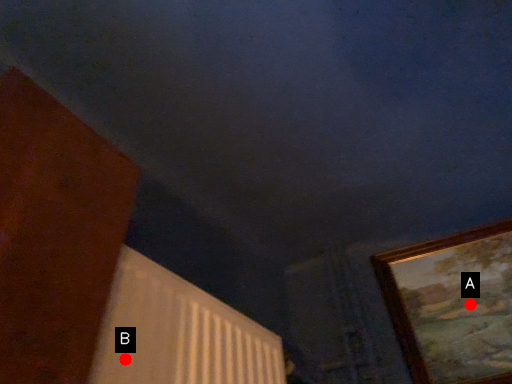
Question: Two points are circled on the image, labeled by A and B beside each circle. Among these points, which one is nearest to the camera?

Choices:
 (A) A is closer
 (B) B is closer

Answer: (B)